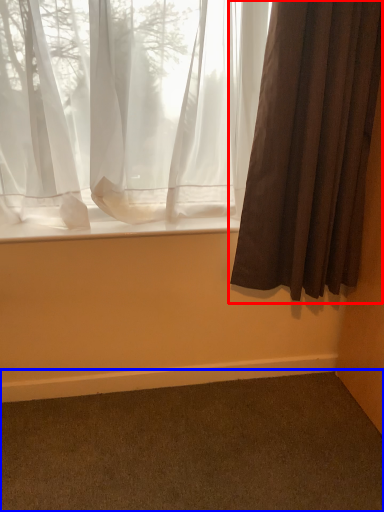
Question: Which point is further to the camera, curtain (highlighted by a red box) or plain (highlighted by a blue box)?

Choices:
 (A) curtain
 (B) plain

Answer: (A)